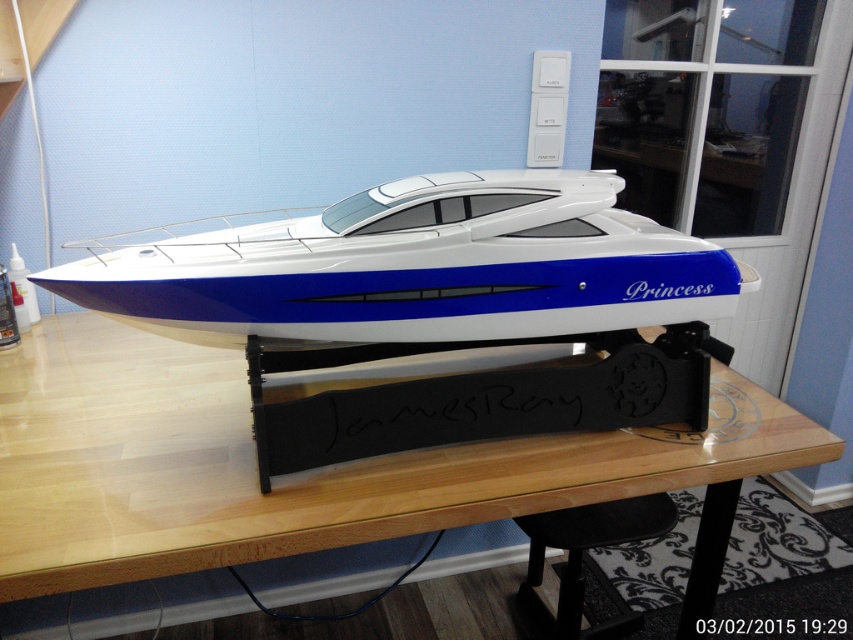
Is blue glossy boat at center smaller than wooden table at center?

Yes, blue glossy boat at center is smaller than wooden table at center.

Does blue glossy boat at center have a lesser height compared to wooden table at center?

Indeed, blue glossy boat at center has a lesser height compared to wooden table at center.

Who is more distant from viewer, (154, 301) or (369, 464)?

Positioned behind is point (369, 464).

Locate an element on the screen. blue glossy boat at center is located at coordinates (438, 308).

In the scene shown: Who is shorter, blue glossy boat at center or black matte stool at lower center?

black matte stool at lower center

From the picture: Does blue glossy boat at center have a lesser height compared to black matte stool at lower center?

No.

At what (x,y) coordinates should I click in order to perform the action: click on blue glossy boat at center. Please return your answer as a coordinate pair (x, y). This screenshot has width=853, height=640. Looking at the image, I should click on (438, 308).

Is wooden table at center above black matte stool at lower center?

Yes.

Who is more forward, (4, 580) or (589, 540)?

Positioned in front is point (4, 580).

The image size is (853, 640). What do you see at coordinates (305, 472) in the screenshot? I see `wooden table at center` at bounding box center [305, 472].

Locate an element on the screen. wooden table at center is located at coordinates (305, 472).